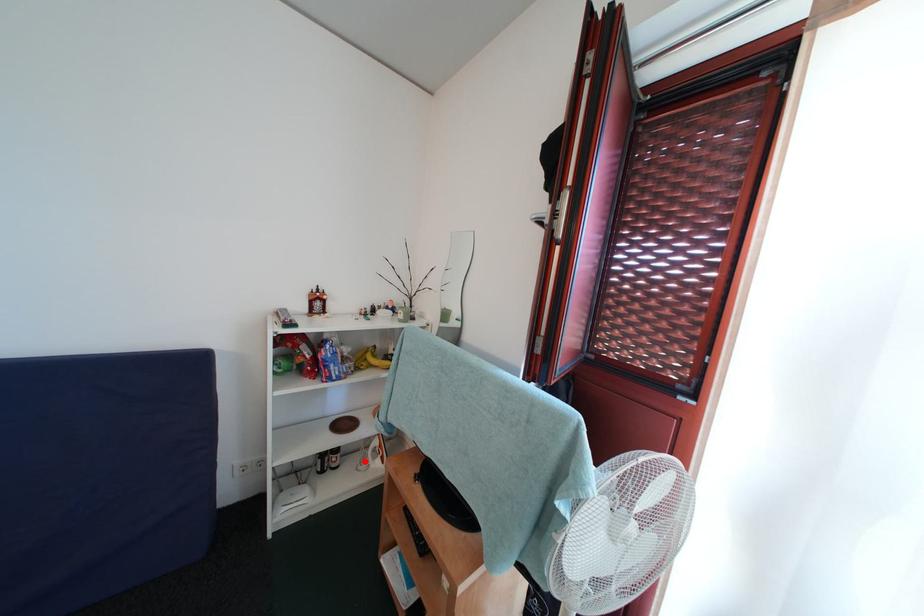
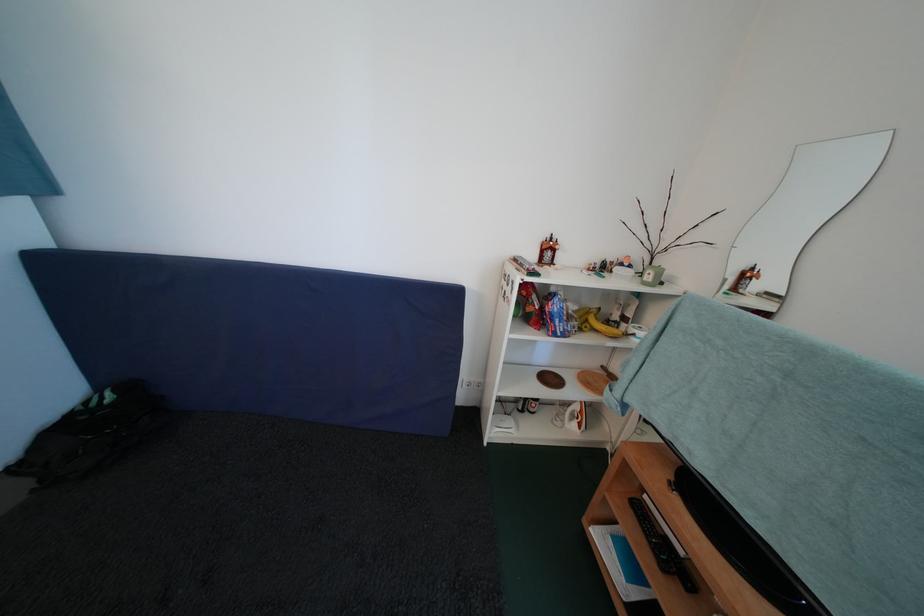
Locate, in the second image, the point that corresponds to the highlighted location in the first image.

(561, 416)